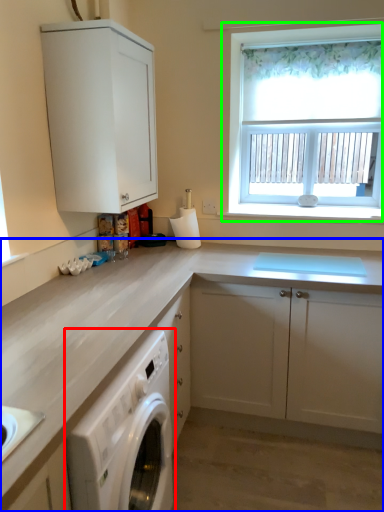
Question: Which object is positioned closest to home appliance (highlighted by a red box)? Select from cabinetry (highlighted by a blue box) and window (highlighted by a green box).

Choices:
 (A) cabinetry
 (B) window

Answer: (A)